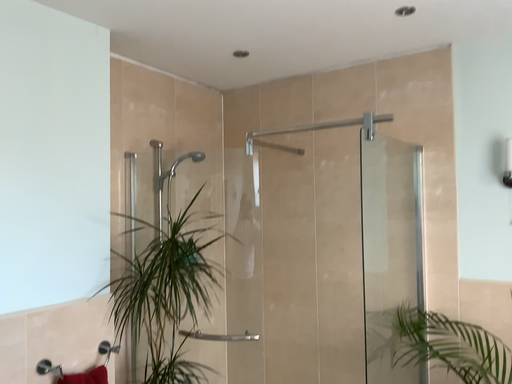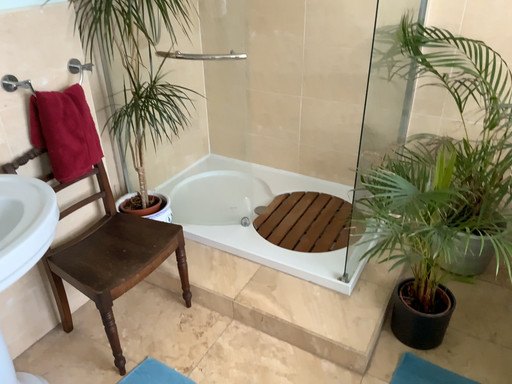
Question: Which way did the camera rotate in the video?

Choices:
 (A) rotated downward
 (B) rotated upward

Answer: (A)